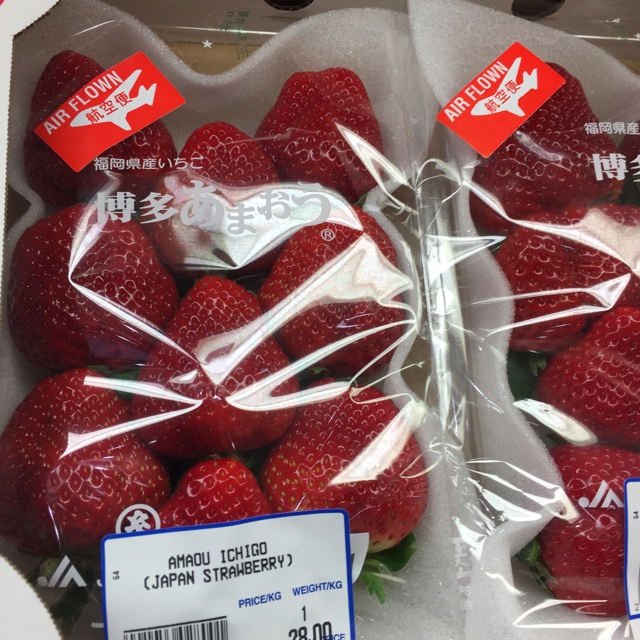
Locate an element on the screen. This screenshot has width=640, height=640. foam backing is located at coordinates (377, 50), (464, 45).